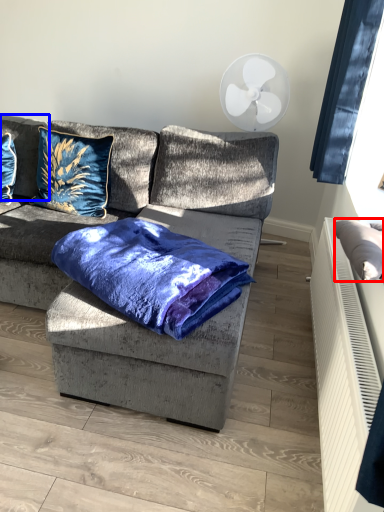
Question: Among these objects, which one is farthest to the camera, pillow (highlighted by a red box) or pillow (highlighted by a blue box)?

Choices:
 (A) pillow
 (B) pillow

Answer: (B)